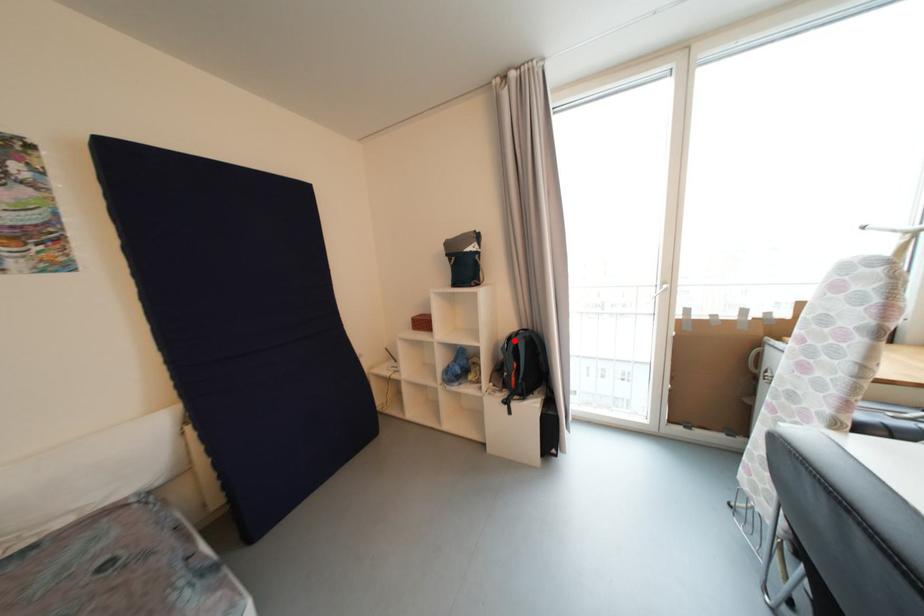
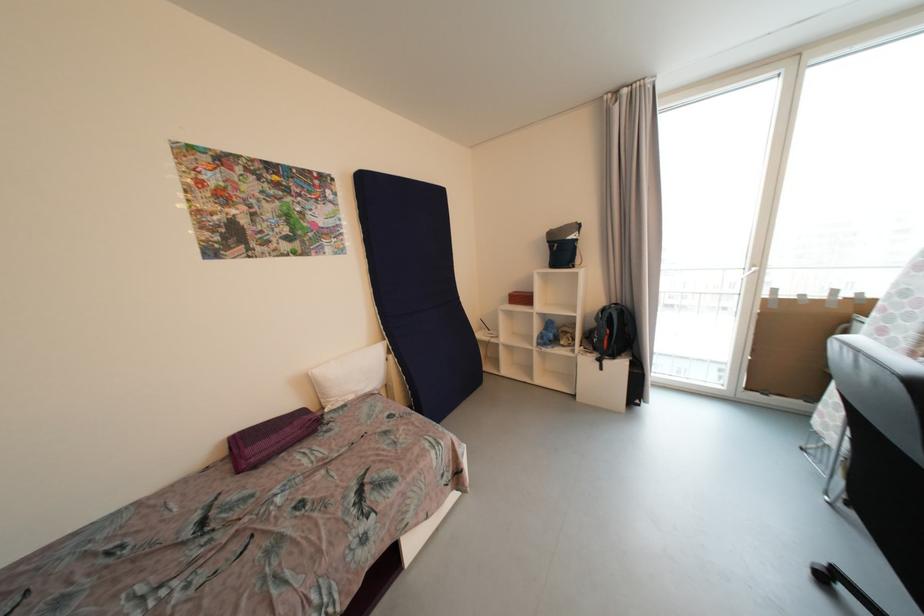
Locate, in the second image, the point that corresponds to the highlighted location in the first image.

(608, 312)